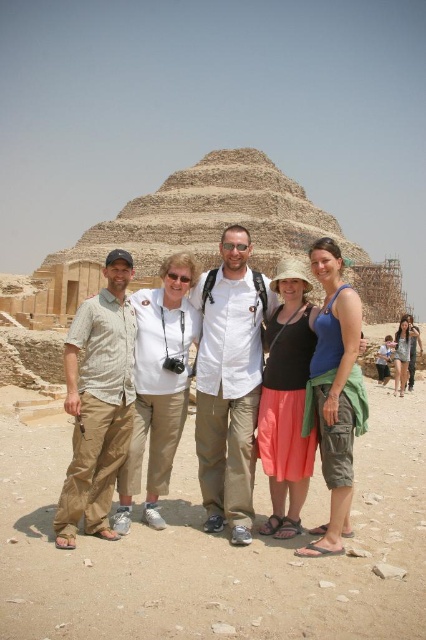
Question: Can you confirm if blue cotton tank top at center is thinner than matte khaki pants at center?

Choices:
 (A) no
 (B) yes

Answer: (B)

Question: Where is blue cotton tank top at center located in relation to matte khaki pants at center in the image?

Choices:
 (A) left
 (B) right

Answer: (B)

Question: Estimate the real-world distances between objects in this image. Which object is farther from the matte khaki pants at center?

Choices:
 (A) khaki pants at center
 (B) blue cotton tank top at center

Answer: (A)

Question: Which point is farther to the camera?

Choices:
 (A) matte khaki pants at center
 (B) blue cotton tank top at center
 (C) khaki pants at center

Answer: (C)

Question: Which object is the closest to the blue cotton tank top at center?

Choices:
 (A) khaki pants at center
 (B) matte khaki pants at center

Answer: (B)

Question: Is khaki pants at center to the right of matte khaki pants at center from the viewer's perspective?

Choices:
 (A) no
 (B) yes

Answer: (A)